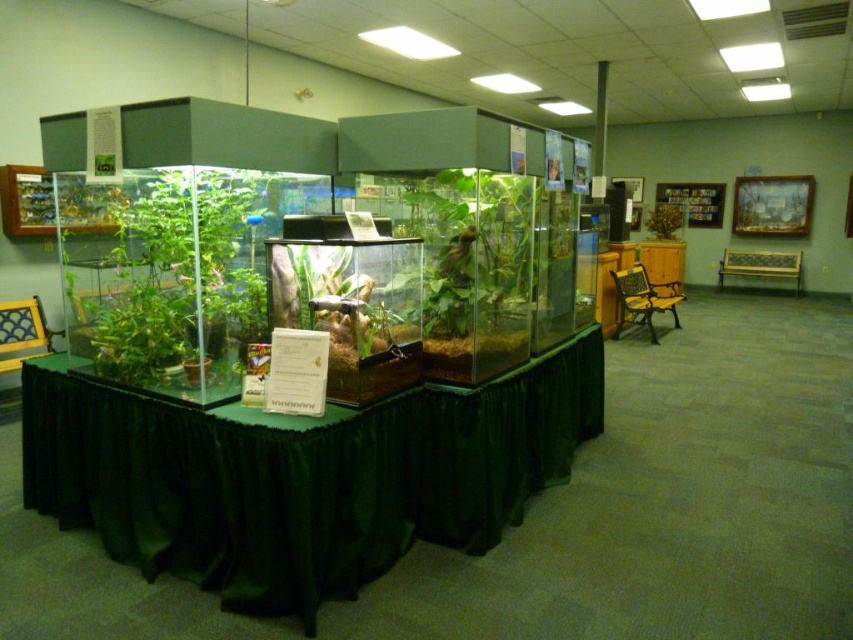
Can you confirm if green fabric table at center is taller than green matte plant at upper center?

Correct, green fabric table at center is much taller as green matte plant at upper center.

The image size is (853, 640). Identify the location of green fabric table at center. (303, 477).

Is green glossy plant at left further to camera compared to green matte plant at center?

No, green glossy plant at left is closer to the viewer.

Between point (144, 189) and point (517, 269), which one is positioned in front?

Point (144, 189) is more forward.

Does point (132, 310) lie behind point (450, 289)?

No, it is in front of (450, 289).

Locate an element on the screen. green glossy plant at left is located at coordinates tap(180, 282).

Is green fabric table at center smaller than green matte plant at center?

No.

Can you confirm if green fabric table at center is taller than green matte plant at center?

Indeed, green fabric table at center has a greater height compared to green matte plant at center.

Image resolution: width=853 pixels, height=640 pixels. I want to click on green fabric table at center, so click(303, 477).